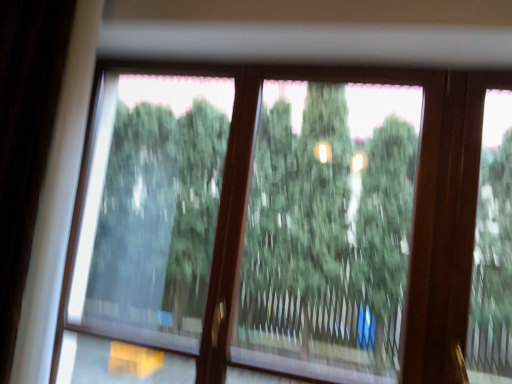
Question: In which direction should I rotate to look at green matte tree at center, positioned as the 1th tree in right-to-left order?

Choices:
 (A) left
 (B) right

Answer: (B)

Question: From a real-world perspective, is green matte tree at center, the first tree from the left, below green matte tree at center, which ranks as the second tree in left-to-right order?

Choices:
 (A) yes
 (B) no

Answer: (A)

Question: Is green matte tree at center, the first tree from the left, shorter than green matte tree at center, which ranks as the second tree in left-to-right order?

Choices:
 (A) yes
 (B) no

Answer: (B)

Question: Considering the relative sizes of green matte tree at center, acting as the second tree starting from the right, and green matte tree at center, positioned as the 1th tree in right-to-left order, in the image provided, is green matte tree at center, acting as the second tree starting from the right, bigger than green matte tree at center, positioned as the 1th tree in right-to-left order,?

Choices:
 (A) no
 (B) yes

Answer: (A)

Question: Can you confirm if green matte tree at center, acting as the second tree starting from the right, is taller than green matte tree at center, which ranks as the second tree in left-to-right order?

Choices:
 (A) yes
 (B) no

Answer: (A)

Question: Is green matte tree at center, the first tree from the left, at the right side of green matte tree at center, which ranks as the second tree in left-to-right order?

Choices:
 (A) yes
 (B) no

Answer: (B)

Question: Does green matte tree at center, the first tree from the left, come in front of green matte tree at center, positioned as the 1th tree in right-to-left order?

Choices:
 (A) yes
 (B) no

Answer: (B)

Question: Does green matte tree at center, which ranks as the second tree in left-to-right order, have a lesser height compared to green matte tree at center, the first tree from the left?

Choices:
 (A) no
 (B) yes

Answer: (B)

Question: Is green matte tree at center, which ranks as the second tree in left-to-right order, surrounding green matte tree at center, acting as the second tree starting from the right?

Choices:
 (A) yes
 (B) no

Answer: (B)

Question: From a real-world perspective, is green matte tree at center, which ranks as the second tree in left-to-right order, physically below green matte tree at center, acting as the second tree starting from the right?

Choices:
 (A) no
 (B) yes

Answer: (A)

Question: Does green matte tree at center, positioned as the 1th tree in right-to-left order, turn towards green matte tree at center, the first tree from the left?

Choices:
 (A) no
 (B) yes

Answer: (A)

Question: Is green matte tree at center, positioned as the 1th tree in right-to-left order, taller than green matte tree at center, the first tree from the left?

Choices:
 (A) no
 (B) yes

Answer: (A)

Question: Does green matte tree at center, which ranks as the second tree in left-to-right order, appear on the left side of green matte tree at center, the first tree from the left?

Choices:
 (A) yes
 (B) no

Answer: (B)

Question: Considering the relative positions of green matte tree at center, which ranks as the second tree in left-to-right order, and green matte tree at center, acting as the second tree starting from the right, in the image provided, is green matte tree at center, which ranks as the second tree in left-to-right order, to the left or to the right of green matte tree at center, acting as the second tree starting from the right,?

Choices:
 (A) left
 (B) right

Answer: (B)